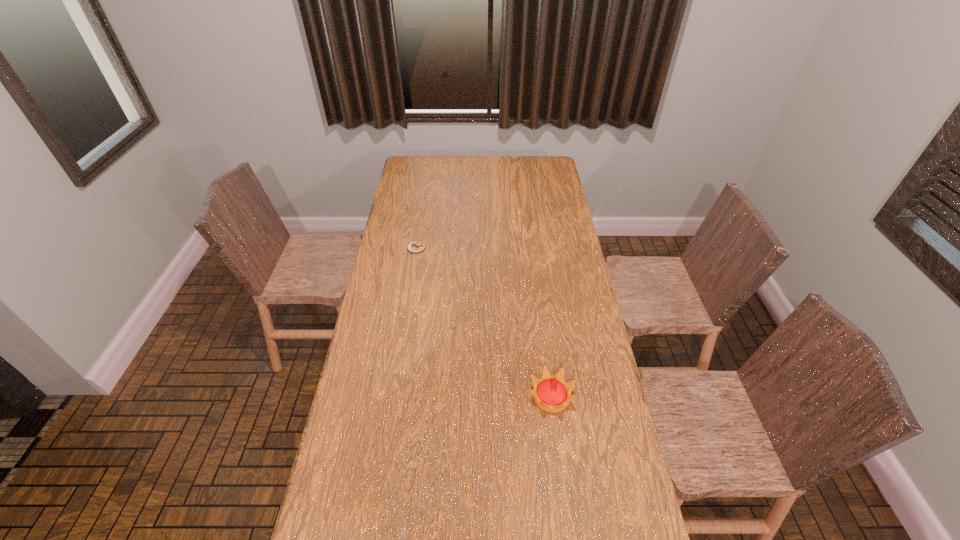
The width and height of the screenshot is (960, 540). What are the coordinates of `vacant area at the right edge` in the screenshot? It's located at (550, 268).

I want to click on free space at the far right corner of the desktop, so point(554,164).

This screenshot has width=960, height=540. I want to click on free spot between the patty and the right object, so click(484, 322).

Where is `free space between the patty and the taller object`? The image size is (960, 540). free space between the patty and the taller object is located at coordinates (484, 322).

The image size is (960, 540). I want to click on vacant area that lies between the right object and the left object, so click(484, 322).

Image resolution: width=960 pixels, height=540 pixels. In order to click on vacant region that satisfies the following two spatial constraints: 1. on the front side of the left object; 2. on the left side of the crown in this screenshot , I will do `click(393, 397)`.

In order to click on vacant space that satisfies the following two spatial constraints: 1. on the front side of the nearer object; 2. on the left side of the left object in this screenshot , I will do `click(393, 397)`.